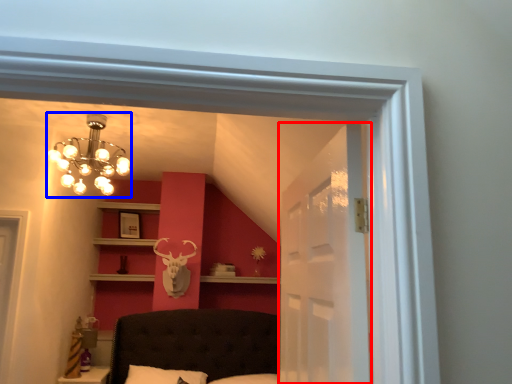
Question: Among these objects, which one is farthest to the camera, glass door (highlighted by a red box) or lamp (highlighted by a blue box)?

Choices:
 (A) glass door
 (B) lamp

Answer: (B)